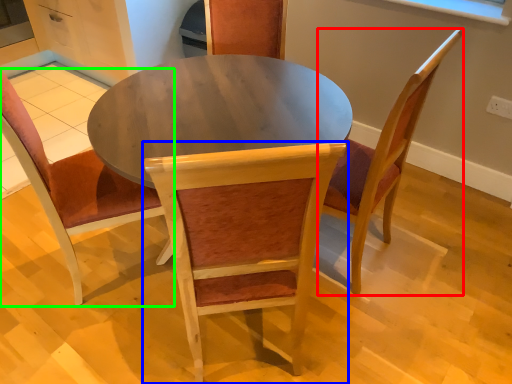
Question: Estimate the real-world distances between objects in this image. Which object is farther from chair (highlighted by a red box), chair (highlighted by a blue box) or chair (highlighted by a green box)?

Choices:
 (A) chair
 (B) chair

Answer: (B)